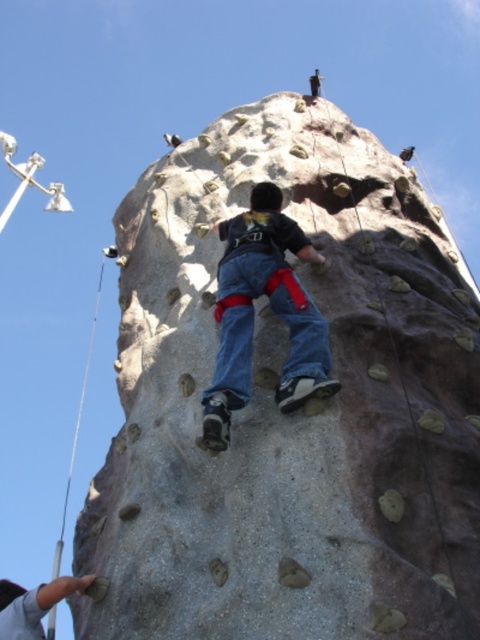
Does gray rough climbing rock at center lie behind denim jeans at center?

That is False.

Is gray rough climbing rock at center below denim jeans at center?

Actually, gray rough climbing rock at center is above denim jeans at center.

The height and width of the screenshot is (640, 480). In order to click on gray rough climbing rock at center in this screenshot , I will do `click(294, 413)`.